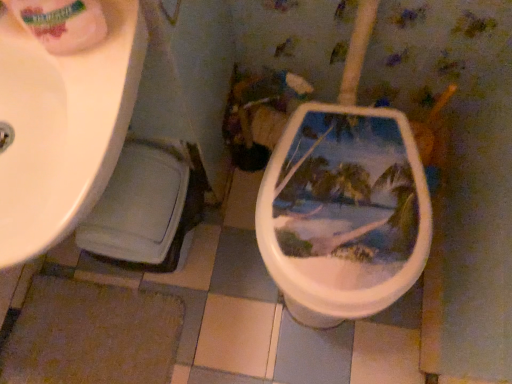
Question: Considering the positions of point (76, 51) and point (110, 79), is point (76, 51) closer or farther from the camera than point (110, 79)?

Choices:
 (A) farther
 (B) closer

Answer: (A)

Question: From the image's perspective, is white glossy toilet paper at upper left above or below white glossy sink at upper left?

Choices:
 (A) below
 (B) above

Answer: (B)

Question: Choose the correct answer: Is white glossy toilet paper at upper left inside white glossy sink at upper left or outside it?

Choices:
 (A) outside
 (B) inside

Answer: (A)

Question: Considering the relative positions of white glossy sink at upper left and white glossy toilet paper at upper left in the image provided, is white glossy sink at upper left to the left or to the right of white glossy toilet paper at upper left?

Choices:
 (A) right
 (B) left

Answer: (B)

Question: From their relative heights in the image, would you say white glossy sink at upper left is taller or shorter than white glossy toilet paper at upper left?

Choices:
 (A) short
 (B) tall

Answer: (B)

Question: From a real-world perspective, is white glossy sink at upper left above or below white glossy toilet paper at upper left?

Choices:
 (A) above
 (B) below

Answer: (B)

Question: Is white glossy sink at upper left wider or thinner than white glossy toilet paper at upper left?

Choices:
 (A) thin
 (B) wide

Answer: (B)